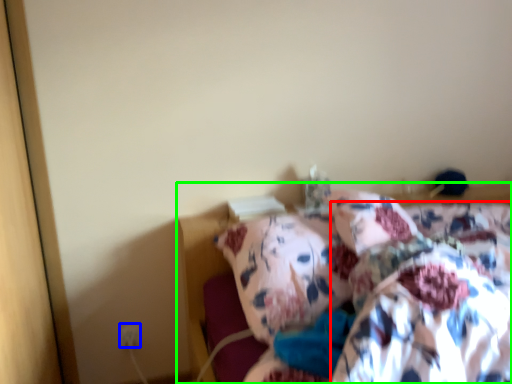
Question: Which object is positioned farthest from blanket (highlighted by a red box)? Select from electric outlet (highlighted by a blue box) and bed (highlighted by a green box).

Choices:
 (A) electric outlet
 (B) bed

Answer: (A)